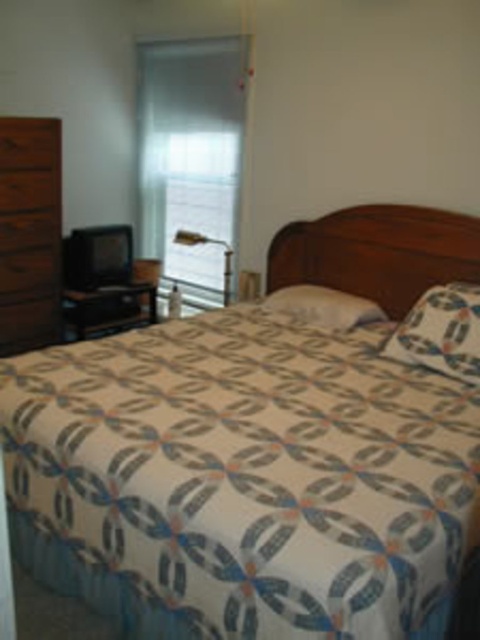
Does patterned fabric bed at center appear over metallic gold lamp at upper center?

Incorrect, patterned fabric bed at center is not positioned above metallic gold lamp at upper center.

How much distance is there between patterned fabric bed at center and metallic gold lamp at upper center?

patterned fabric bed at center is 28.34 inches away from metallic gold lamp at upper center.

The height and width of the screenshot is (640, 480). Find the location of `patterned fabric bed at center`. patterned fabric bed at center is located at coordinates (377, 250).

What do you see at coordinates (441, 332) in the screenshot?
I see `patterned fabric pillow at center` at bounding box center [441, 332].

From the picture: Does patterned fabric pillow at center have a smaller size compared to white textured pillow at center?

Actually, patterned fabric pillow at center might be larger than white textured pillow at center.

Is point (472, 317) positioned in front of point (297, 312)?

Yes, point (472, 317) is closer to viewer.

Image resolution: width=480 pixels, height=640 pixels. In order to click on patterned fabric pillow at center in this screenshot , I will do `click(441, 332)`.

Between patterned fabric pillow at center and metallic gold lamp at upper center, which one appears on the left side from the viewer's perspective?

metallic gold lamp at upper center is more to the left.

In the scene shown: Who is higher up, patterned fabric pillow at center or metallic gold lamp at upper center?

metallic gold lamp at upper center is above.

Does point (406, 352) come behind point (193, 236)?

No, it is not.

Locate an element on the screen. Image resolution: width=480 pixels, height=640 pixels. patterned fabric pillow at center is located at coordinates (441, 332).